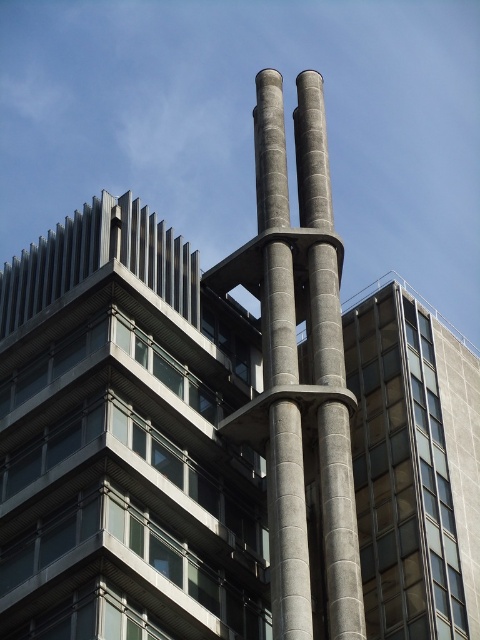
You are standing at the entrance of the building and want to take a photo of the gray concrete pillar at center. If your camera has a maximum focus range of 50 meters, will it be able to capture the pillar clearly?

The gray concrete pillar at center is 46.92 meters away from the camera. Since this distance is within the camera maximum focus range of 50 meters, the camera can capture the pillar clearly.

You are standing at the entrance of the building and want to take a photo of the gray concrete pillars at center. If your camera has a maximum zoom range of 50 meters, will you be able to capture the pillars clearly in your photo?

The gray concrete pillars at center are 47.04 meters away from the camera. Since the camera can zoom up to 50 meters, you can capture the pillars clearly within the maximum zoom range.

You are standing at a distance of 200 feet from the building. You want to move closer to the point at coordinates point [257,88]. Can you reach the point without moving past the building?

The distance of point [257,88] from viewer is 278.19 feet, so you are currently 200 feet away. You need to move an additional 78.19 feet closer to reach the point without moving past it.